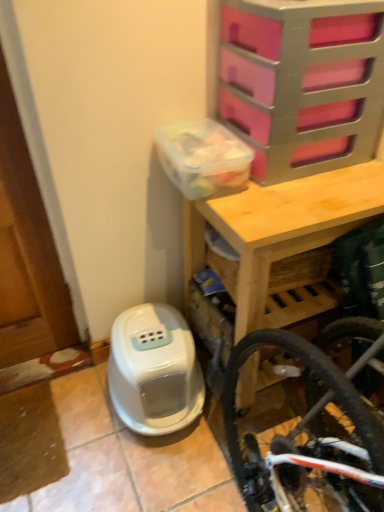
Find the location of `vacant space situated above white plastic water heater at lower left (from a real-world perspective)`. vacant space situated above white plastic water heater at lower left (from a real-world perspective) is located at coordinates (150, 339).